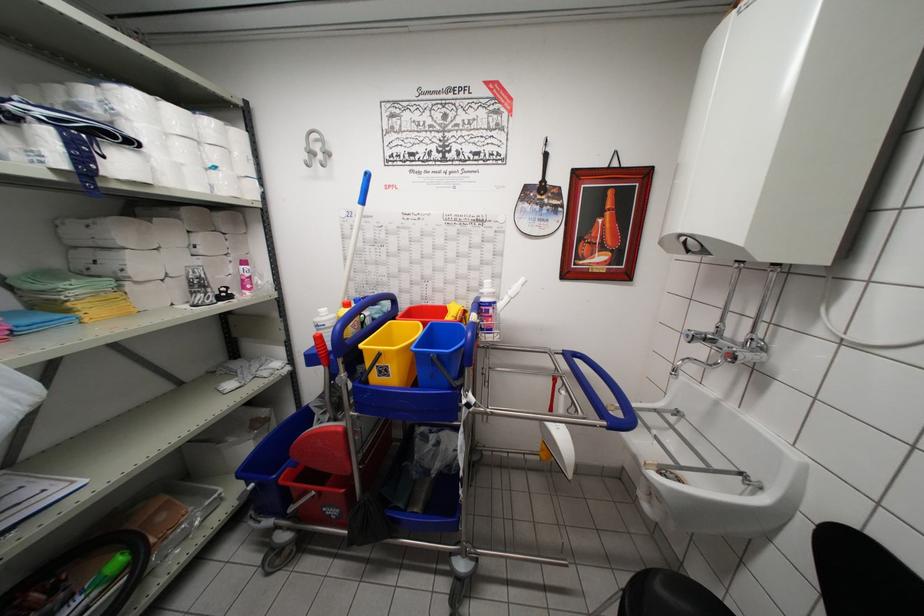
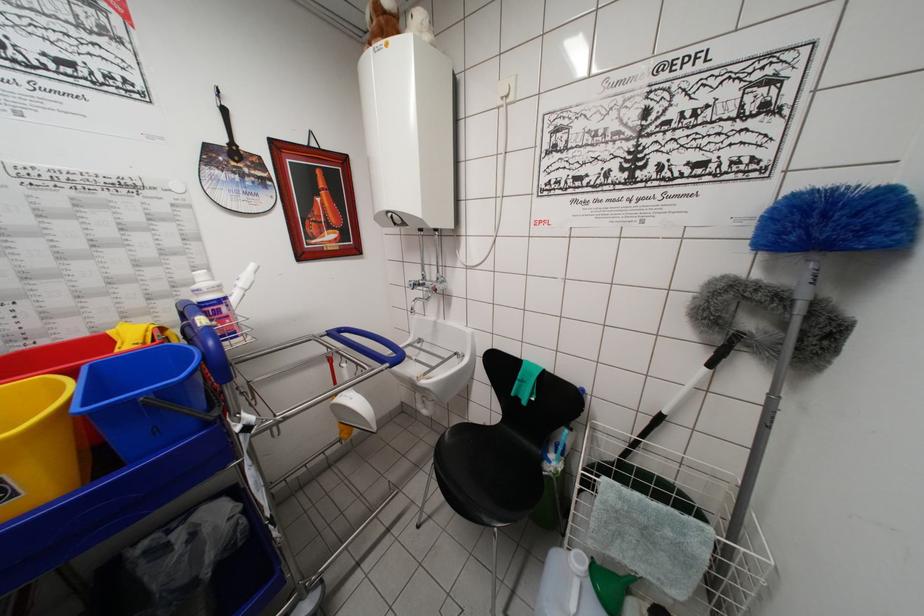
Where in the second image is the point corresponding to point 432,358 from the first image?

(136, 405)